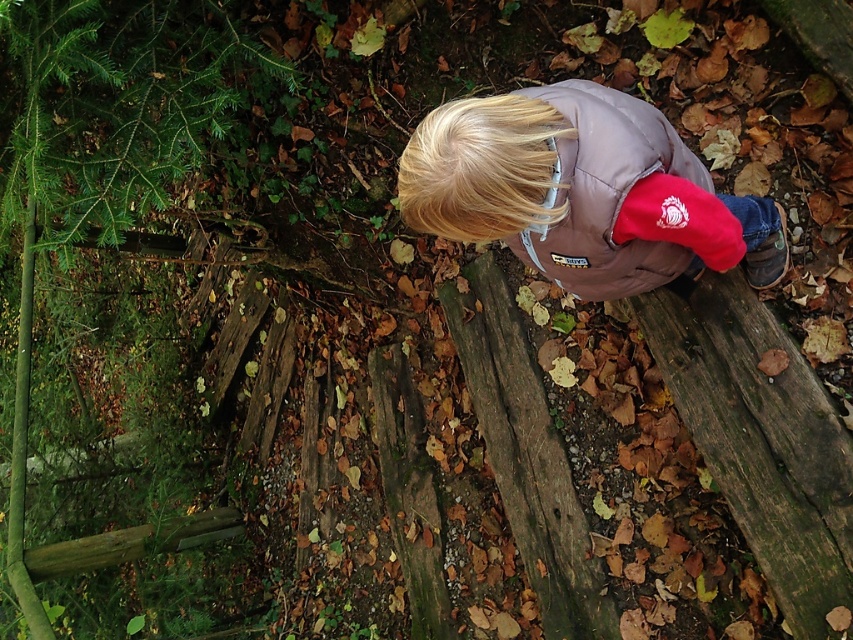
What do you see at coordinates (115, 104) in the screenshot? I see `green textured pine tree at left` at bounding box center [115, 104].

Does green textured pine tree at left have a greater width compared to green rough wood at center?

Correct, the width of green textured pine tree at left exceeds that of green rough wood at center.

Locate an element on the screen. The width and height of the screenshot is (853, 640). green textured pine tree at left is located at coordinates (115, 104).

At what (x,y) coordinates should I click in order to perform the action: click on green textured pine tree at left. Please return your answer as a coordinate pair (x, y). The image size is (853, 640). Looking at the image, I should click on (115, 104).

Is the position of green rough wood at center more distant than that of brown matte jacket at center?

Yes.

Based on the photo, which is below, green rough wood at center or brown matte jacket at center?

green rough wood at center is below.

Identify the location of green rough wood at center. (526, 456).

Does green textured pine tree at left appear under brown matte jacket at center?

Incorrect, green textured pine tree at left is not positioned below brown matte jacket at center.

Can you confirm if green textured pine tree at left is thinner than brown matte jacket at center?

In fact, green textured pine tree at left might be wider than brown matte jacket at center.

Is point (56, 51) closer to camera compared to point (682, 164)?

No, it is behind (682, 164).

The height and width of the screenshot is (640, 853). In order to click on green textured pine tree at left in this screenshot , I will do pyautogui.click(x=115, y=104).